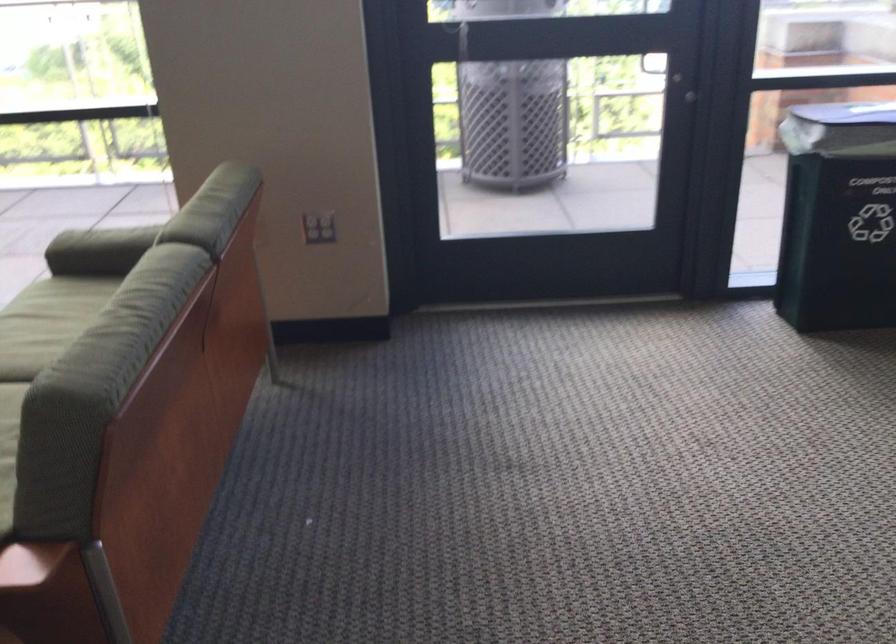
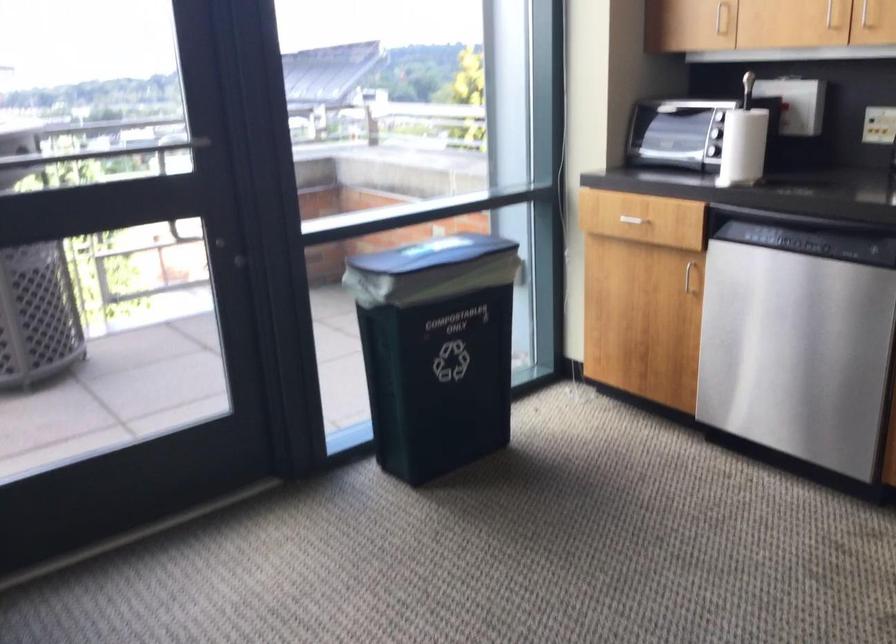
Question: The camera is either moving clockwise (left) or counter-clockwise (right) around the object. The first image is from the beginning of the video and the second image is from the end. Is the camera moving left or right when shooting the video?

Choices:
 (A) Left
 (B) Right

Answer: (A)